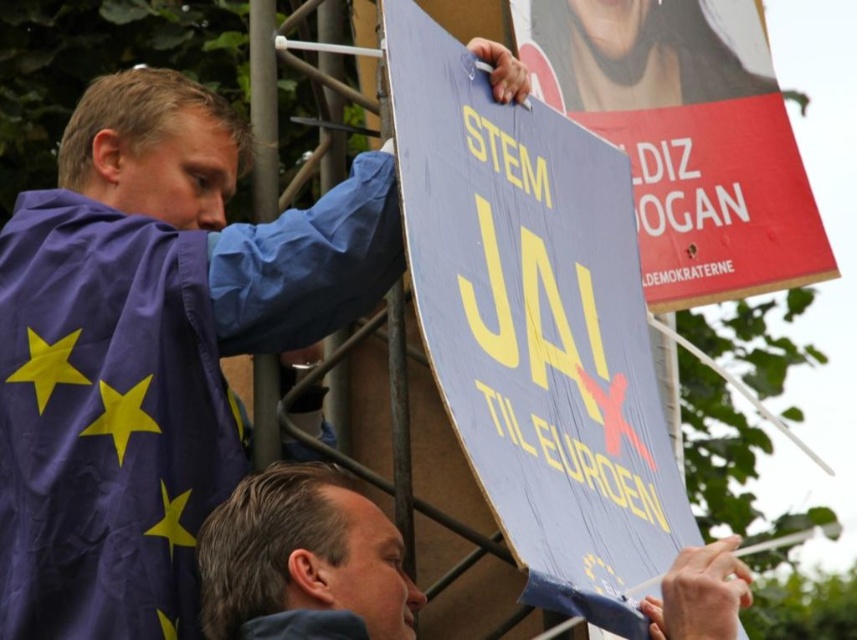
Is the position of purple fabric robe at upper left more distant than that of wooden sign at center?

Yes, purple fabric robe at upper left is further from the viewer.

Is purple fabric robe at upper left closer to camera compared to wooden sign at center?

No, it is not.

This screenshot has height=640, width=857. What are the coordinates of `purple fabric robe at upper left` in the screenshot? It's located at (148, 387).

What are the coordinates of `purple fabric robe at upper left` in the screenshot? It's located at pos(148,387).

Can you confirm if purple fabric robe at upper left is positioned above smooth blue sign at center?

Correct, purple fabric robe at upper left is located above smooth blue sign at center.

Does purple fabric robe at upper left appear on the right side of smooth blue sign at center?

In fact, purple fabric robe at upper left is to the left of smooth blue sign at center.

Does point (391, 259) come in front of point (693, 637)?

That is False.

This screenshot has height=640, width=857. What are the coordinates of `purple fabric robe at upper left` in the screenshot? It's located at (148, 387).

Who is taller, wooden sign at center or smooth blue sign at center?

wooden sign at center

Is point (610, 394) more distant than point (703, 570)?

Yes, point (610, 394) is farther from viewer.

Where is `wooden sign at center`? The height and width of the screenshot is (640, 857). wooden sign at center is located at coordinates (535, 326).